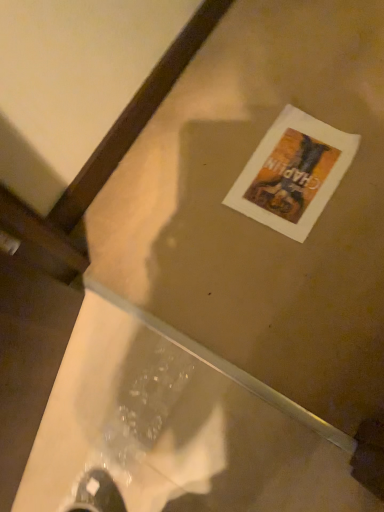
Question: Should I look upward or downward to see white paper book at center?

Choices:
 (A) up
 (B) down

Answer: (A)